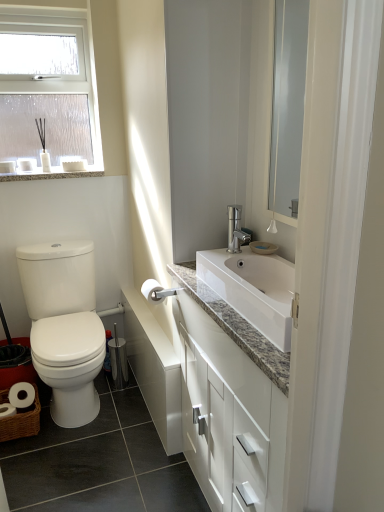
You are a GUI agent. You are given a task and a screenshot of the screen. Output one action in this format:
    pyautogui.click(x=<x>, y=<y>)
    Task: Click on the free spot above frosted glass window at upper left (from a real-world perspective)
    This screenshot has height=512, width=384.
    Given the screenshot: What is the action you would take?
    pyautogui.click(x=40, y=15)